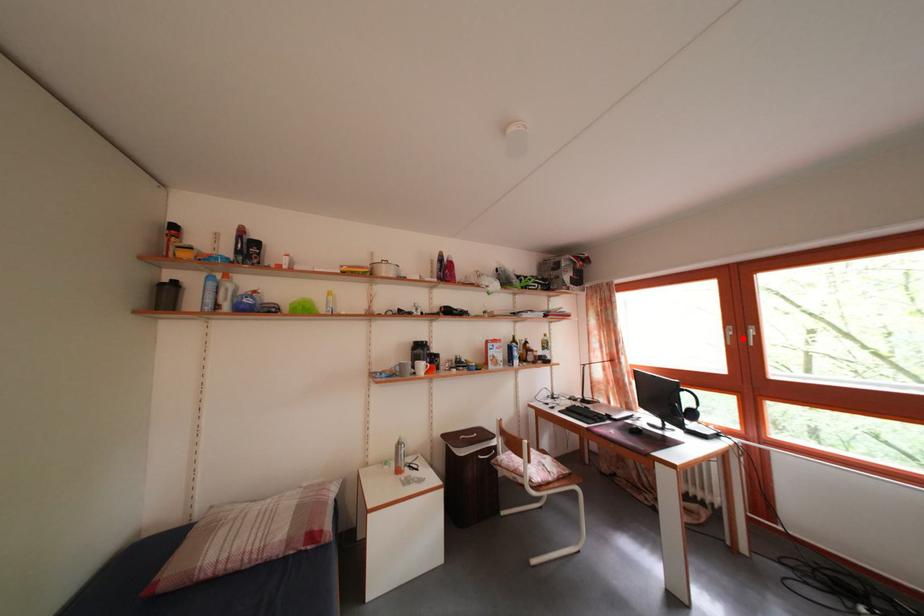
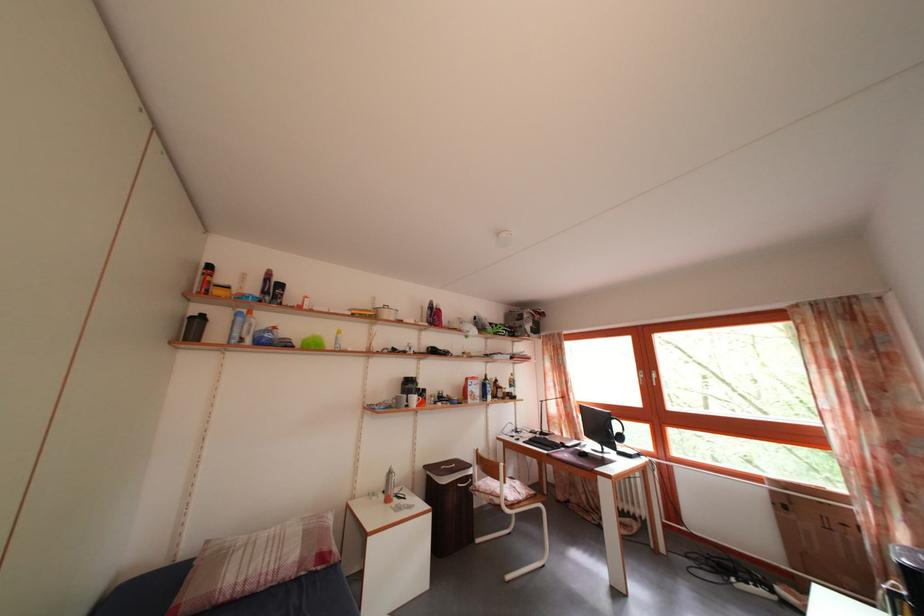
In the second image, find the point that corresponds to the highlighted location in the first image.

(652, 382)